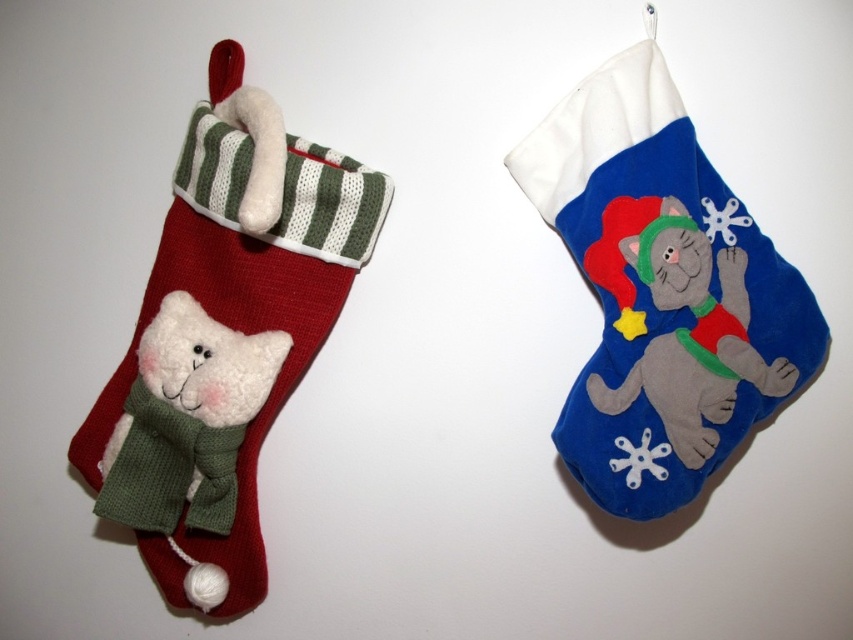
Does velvet blue stocking at upper right appear under fuzzy gray cat at right?

No, velvet blue stocking at upper right is not below fuzzy gray cat at right.

Is point (743, 248) more distant than point (749, 353)?

Yes, point (743, 248) is farther from viewer.

Image resolution: width=853 pixels, height=640 pixels. Identify the location of velvet blue stocking at upper right. (660, 291).

Which is below, white fluffy teddy at left or fuzzy gray cat at right?

white fluffy teddy at left

Consider the image. Is white fluffy teddy at left smaller than fuzzy gray cat at right?

Actually, white fluffy teddy at left might be larger than fuzzy gray cat at right.

This screenshot has width=853, height=640. Identify the location of white fluffy teddy at left. (187, 429).

Which of these two, knitted woolen cat at left or white fluffy teddy at left, stands taller?

knitted woolen cat at left

Does point (276, 115) lie behind point (190, 477)?

No.

The width and height of the screenshot is (853, 640). Find the location of `knitted woolen cat at left`. knitted woolen cat at left is located at coordinates (225, 336).